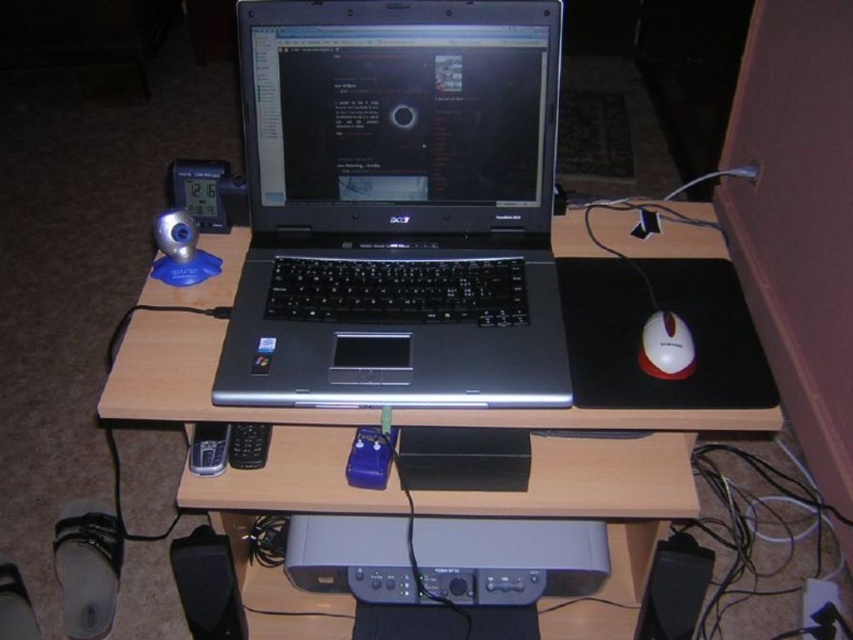
You are looking at the workspace setup and want to place a new sticker on the desk. The sticker has coordinates for placement at point A and point B. Point A corresponds to point (207, 540) and point B corresponds to point (689, 534). Which point is closer to you, the observer?

Point A corresponds to point (207, 540) is closer to the camera than point B corresponds to point (689, 534).

Based on the photo, you are setting up a new desk and want to place a wireless charger exactly halfway between the black plastic speaker at lower left and the edge of the desk. What are the coordinates where you should place the wireless charger?

The coordinates for placing the wireless charger halfway between the black plastic speaker at lower left and the edge of the desk would be the midpoint between the speaker at point (207, 584) and the desk edge. Since the desk edge is at the lower right corner, the midpoint would be at approximately (207, 612).